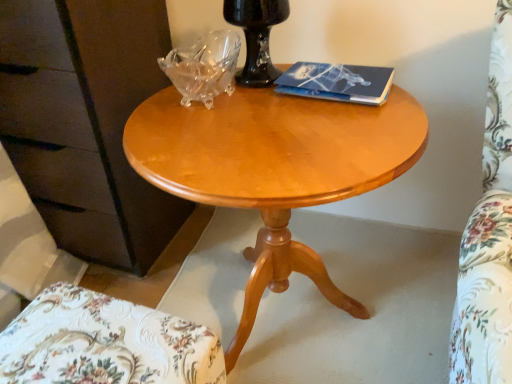
You are a GUI agent. You are given a task and a screenshot of the screen. Output one action in this format:
    pyautogui.click(x=<x>, y=<y>)
    Task: Click on the vacant region above white floral fabric chair at lower left (from a real-world perspective)
    The width and height of the screenshot is (512, 384).
    Given the screenshot: What is the action you would take?
    pyautogui.click(x=87, y=347)